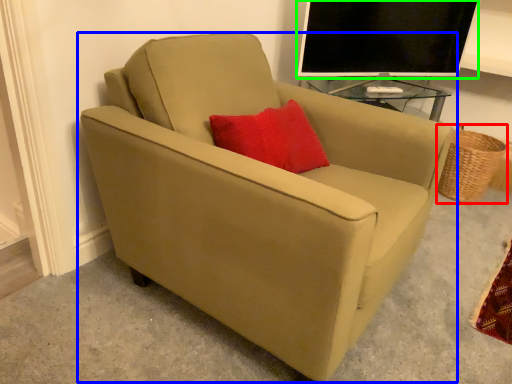
Question: Estimate the real-world distances between objects in this image. Which object is farther from basket (highlighted by a red box), chair (highlighted by a blue box) or television (highlighted by a green box)?

Choices:
 (A) chair
 (B) television

Answer: (A)